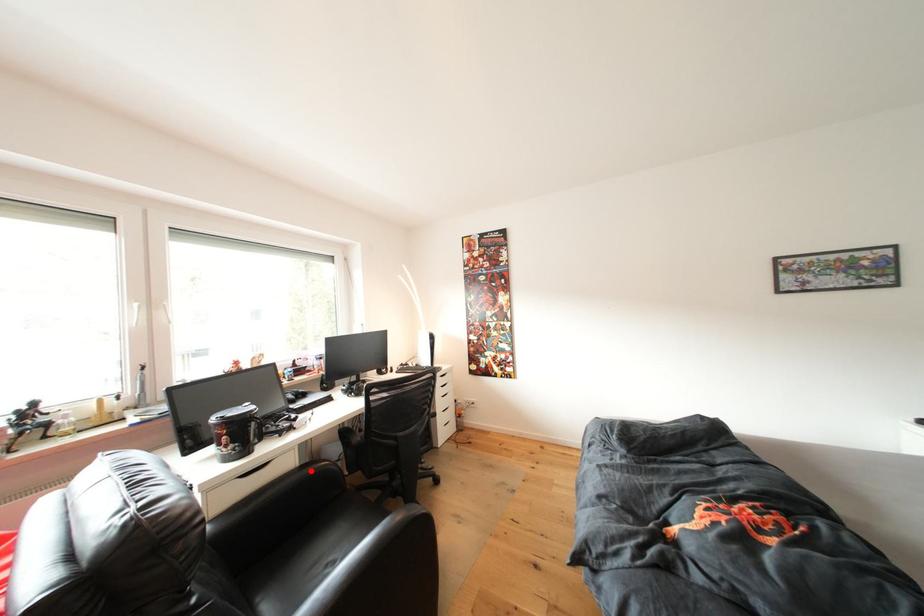
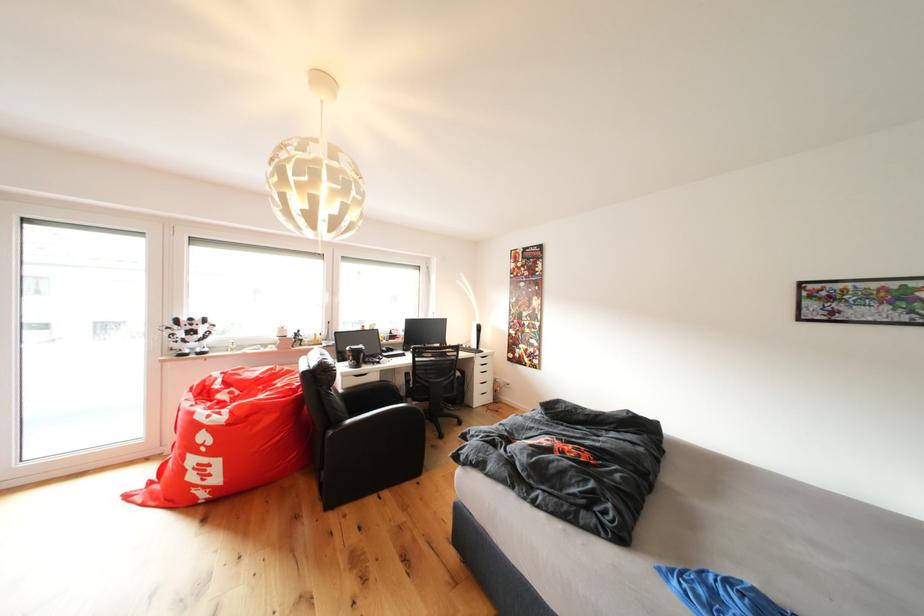
Question: I am providing you with two images of the same scene from different viewpoints. Given a red point in image1, look at the same physical point in image2. Is it:

Choices:
 (A) Closer to the viewpoint
 (B) Farther from the viewpoint

Answer: (B)